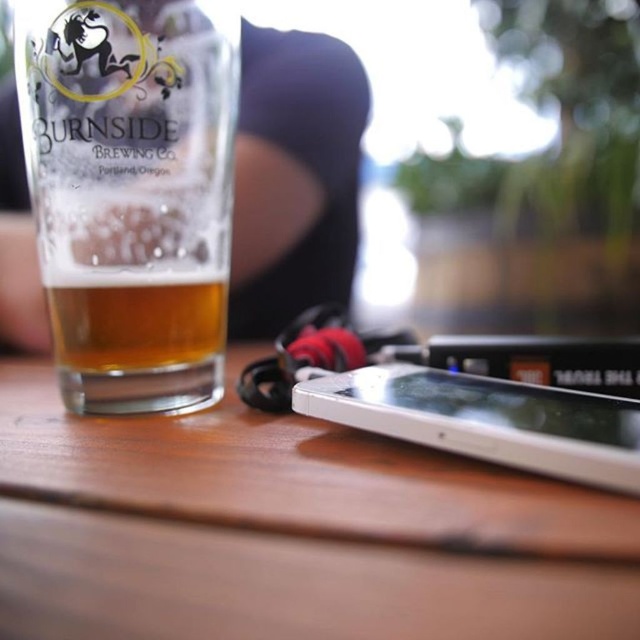
Question: Which of the following is the closest to the observer?

Choices:
 (A) (628, 481)
 (B) (108, 124)
 (C) (216, 548)

Answer: (C)

Question: Can you confirm if clear glass beer at left is positioned to the left of white glossy smartphone at lower center?

Choices:
 (A) no
 (B) yes

Answer: (B)

Question: Which of the following is the farthest from the observer?

Choices:
 (A) golden glass at center
 (B) white glossy smartphone at lower center
 (C) clear glass beer at left

Answer: (A)

Question: Is clear glass beer at left below white glossy smartphone at lower center?

Choices:
 (A) no
 (B) yes

Answer: (A)

Question: Which of the following is the closest to the observer?

Choices:
 (A) golden glass at center
 (B) wooden table at center

Answer: (B)

Question: Is wooden table at center positioned at the back of golden glass at center?

Choices:
 (A) no
 (B) yes

Answer: (A)